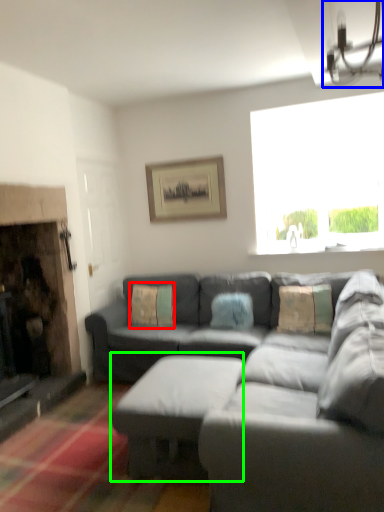
Question: Which object is positioned farthest from pillow (highlighted by a red box)? Select from light fixture (highlighted by a blue box) and table (highlighted by a green box).

Choices:
 (A) light fixture
 (B) table

Answer: (A)